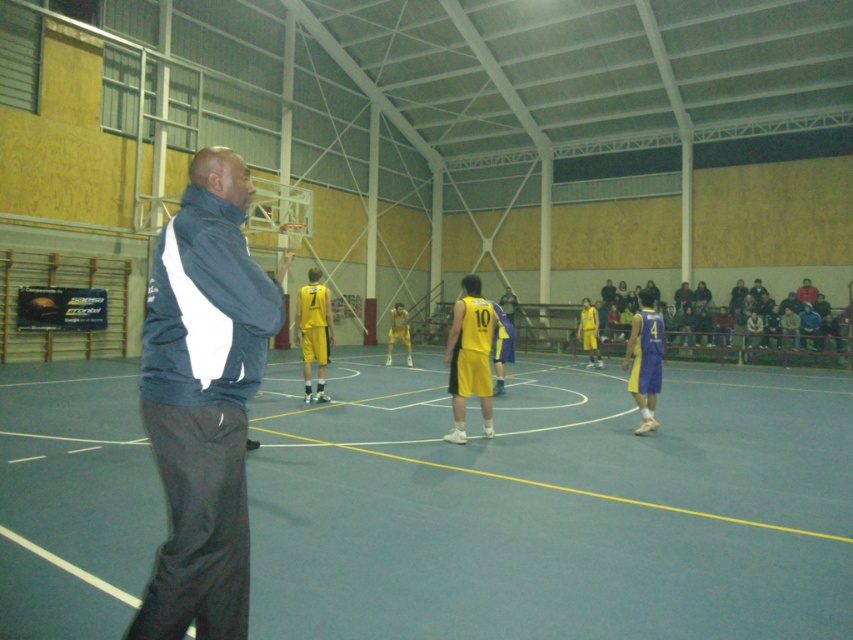
Question: Does navy blue fabric jacket at left have a lesser width compared to yellow jersey at center?

Choices:
 (A) yes
 (B) no

Answer: (B)

Question: Which point is closer to the camera?

Choices:
 (A) smooth gray court at center
 (B) blue jersey at center
 (C) yellow jersey at center
 (D) navy blue fabric jacket at left

Answer: (D)

Question: Is navy blue fabric jacket at left positioned behind yellow matte basketball player at center?

Choices:
 (A) yes
 (B) no

Answer: (B)

Question: Which of the following is the closest to the observer?

Choices:
 (A) (647, 317)
 (B) (236, 420)
 (C) (682, 442)
 (D) (482, 376)

Answer: (B)

Question: Does smooth gray court at center appear on the right side of yellow jersey at center?

Choices:
 (A) yes
 (B) no

Answer: (A)

Question: Which point appears closest to the camera in this image?

Choices:
 (A) (808, 376)
 (B) (196, 513)
 (C) (305, 381)
 (D) (494, 317)

Answer: (B)